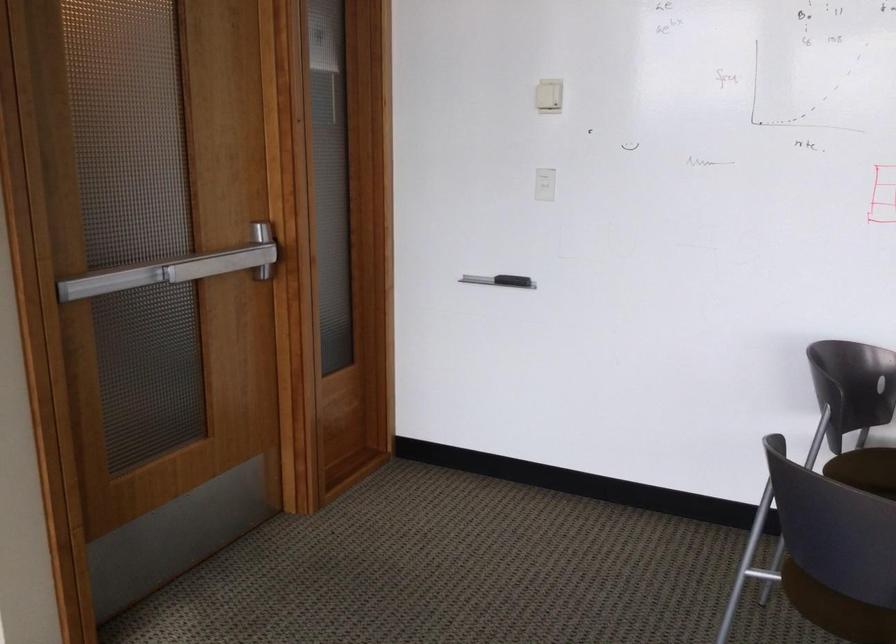
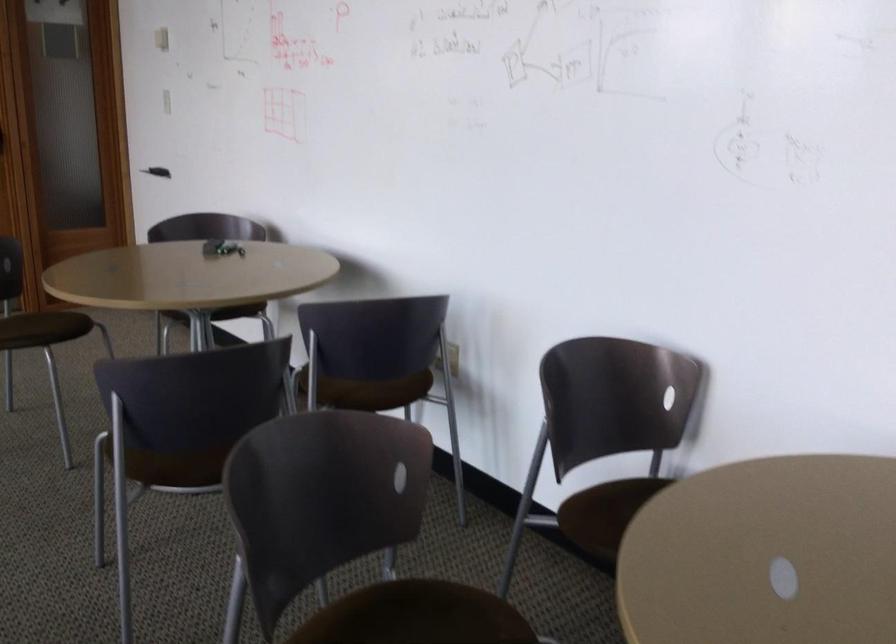
Question: Which direction would the cameraman need to move to produce the second image? Reply with the corresponding letter.

Choices:
 (A) Left
 (B) Right
 (C) Forward
 (D) Backward

Answer: (B)